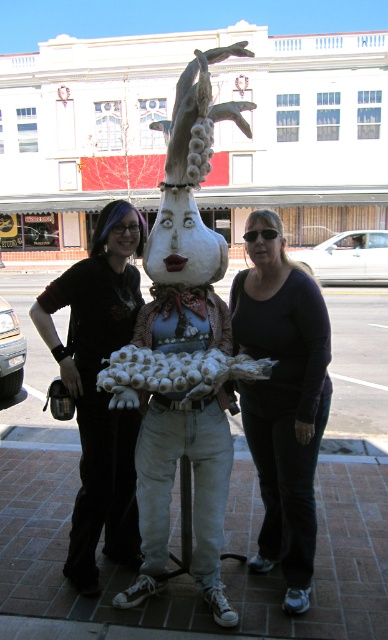
Who is positioned more to the left, brick pavement at center or black matte pants at lower center?

brick pavement at center is more to the left.

Looking at this image, between brick pavement at center and black matte pants at lower center, which one has more height?

black matte pants at lower center

Does point (152, 612) come closer to viewer compared to point (296, 364)?

That is False.

At what (x,y) coordinates should I click in order to perform the action: click on brick pavement at center. Please return your answer as a coordinate pair (x, y). This screenshot has width=388, height=640. Looking at the image, I should click on (188, 576).

In the scene shown: Does brick pavement at center appear on the left side of matte black shirt at center?

In fact, brick pavement at center is to the right of matte black shirt at center.

Which is in front, point (114, 620) or point (76, 568)?

Point (114, 620) is in front.

Image resolution: width=388 pixels, height=640 pixels. Find the location of `brick pavement at center`. brick pavement at center is located at coordinates (188, 576).

Who is higher up, white matte sculpture at center or matte black shirt at center?

Positioned higher is white matte sculpture at center.

Which is behind, point (195, 442) or point (117, 288)?

The point (117, 288) is behind.

The height and width of the screenshot is (640, 388). I want to click on white matte sculpture at center, so click(x=188, y=224).